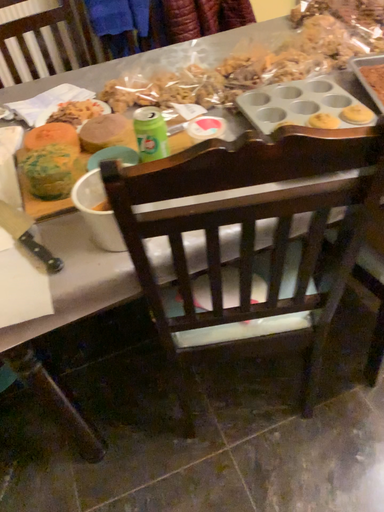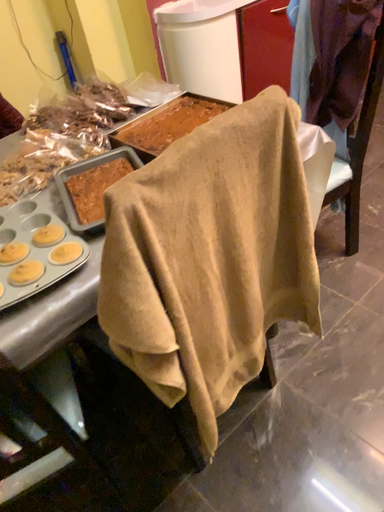
Question: Which way did the camera rotate in the video?

Choices:
 (A) rotated left
 (B) rotated right

Answer: (B)